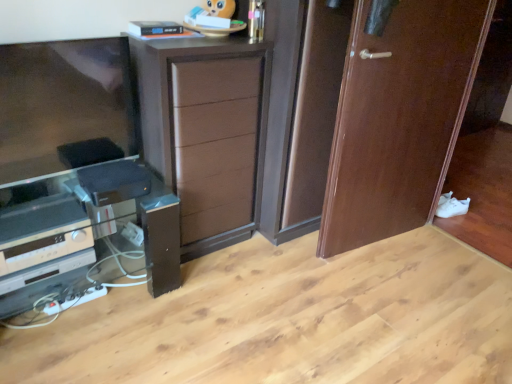
You are a GUI agent. You are given a task and a screenshot of the screen. Output one action in this format:
    pyautogui.click(x=<x>, y=<y>)
    Task: Click on the vacant area that is in front of wooden door at right
    Image resolution: width=512 pixels, height=384 pixels.
    Given the screenshot: What is the action you would take?
    pyautogui.click(x=395, y=292)